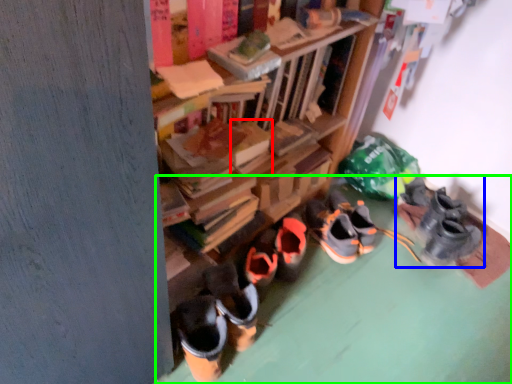
Question: Which object is the farthest from book (highlighted by a red box)? Choose among these: footwear (highlighted by a blue box) or concrete (highlighted by a green box).

Choices:
 (A) footwear
 (B) concrete

Answer: (A)